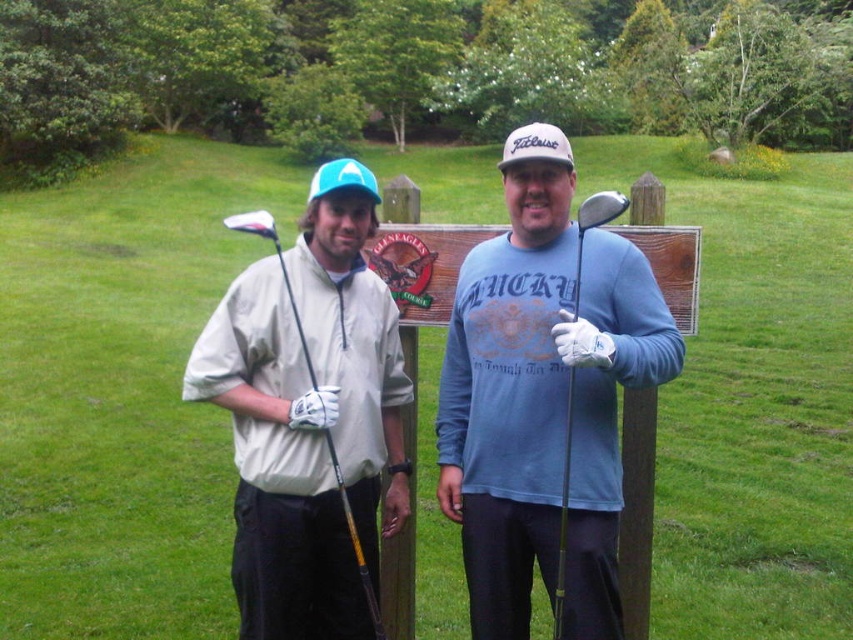
Between matte blue shirt at center and matte black golf club at left, which one is positioned lower?

matte blue shirt at center is below.

Is point (596, 477) farther from viewer compared to point (265, 236)?

No, it is not.

I want to click on matte blue shirt at center, so click(x=543, y=397).

Is point (564, 572) positioned before point (276, 228)?

Yes, point (564, 572) is closer to viewer.

Between shiny silver golf club at center and matte black golf club at left, which one is positioned higher?

matte black golf club at left

Who is more distant from viewer, (619,209) or (372,616)?

The point (372,616) is behind.

The width and height of the screenshot is (853, 640). I want to click on shiny silver golf club at center, so click(x=563, y=513).

Where is `matte blue shirt at center`? This screenshot has width=853, height=640. matte blue shirt at center is located at coordinates point(543,397).

Find the location of a particular element. matte blue shirt at center is located at coordinates (543, 397).